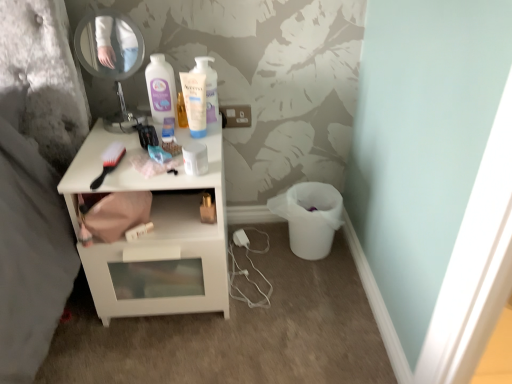
In order to click on vacant area that lies to the right of black plastic brush at upper left in this screenshot , I will do `click(156, 170)`.